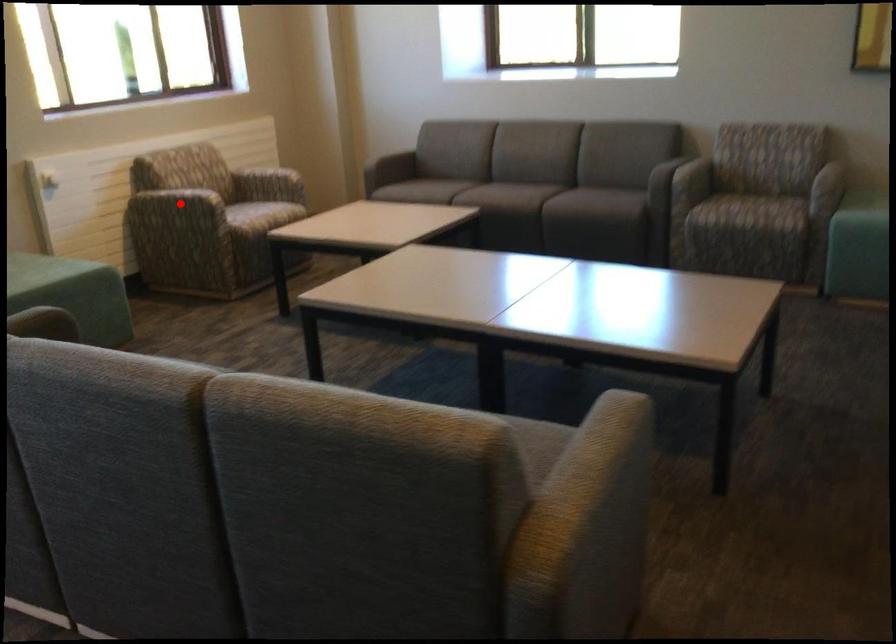
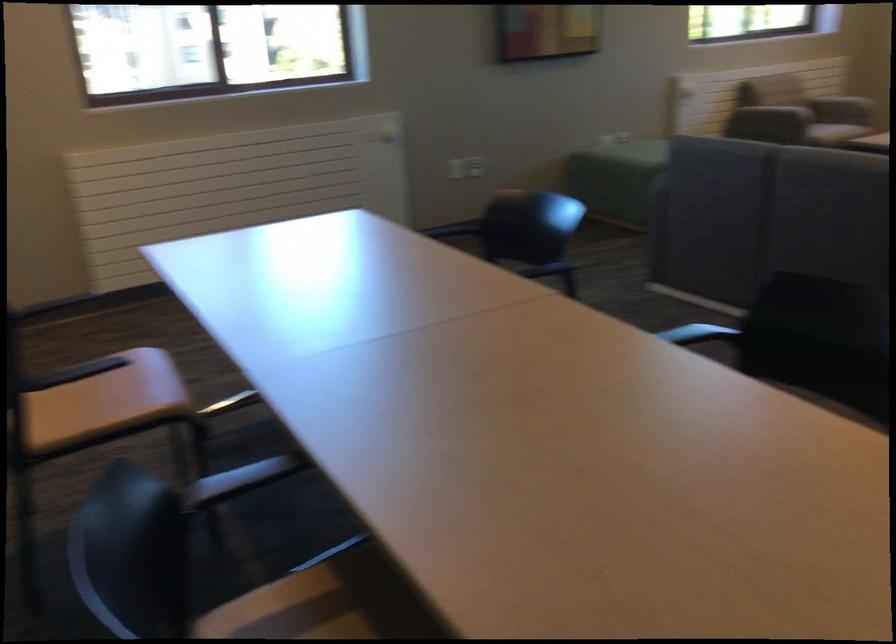
Question: I am providing you with two images of the same scene from different viewpoints. A red point is marked on the first image. Is the red point's position out of view in image 2?

Choices:
 (A) Yes
 (B) No

Answer: (A)